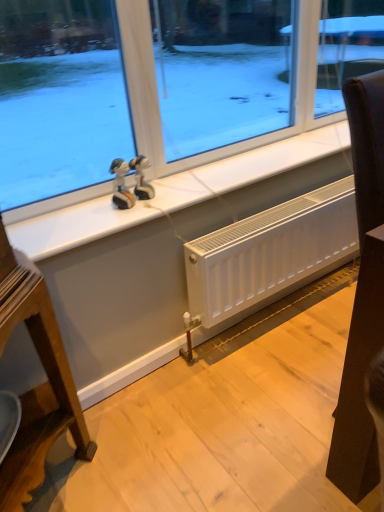
Find the location of `vacant region to the left of black leather chair at right`. vacant region to the left of black leather chair at right is located at coordinates (275, 402).